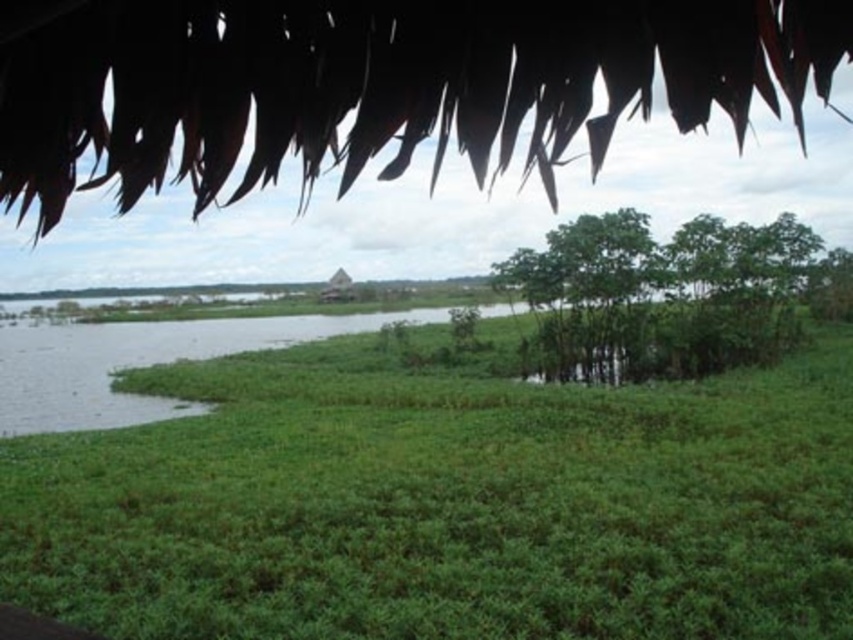
You are a gardener planning to plant flowers between the green leafy grass at center and the green leafy tree at upper center. Which area has more space available for planting?

The green leafy tree at upper center has more space available for planting because it is larger than the green leafy grass at center.

Based on the photo, you are a hiker who wants to cross the water to reach the green leafy tree at upper center. The water is 10 meters wide. Can you safely cross the water if you start from the green leafy grass at center?

The distance between the green leafy grass at center and the green leafy tree at upper center is 13.53 meters. Since the water is only 10 meters wide, the remaining distance after crossing the water would be 3.53 meters. However, the question only mentions the water width, not the total distance. The hiker can cross the 10 meter water width, but the total distance to the tree is longer. The answer should focus on whether the water width allows crossing. Since the water is 10m wide and the hiker starts from